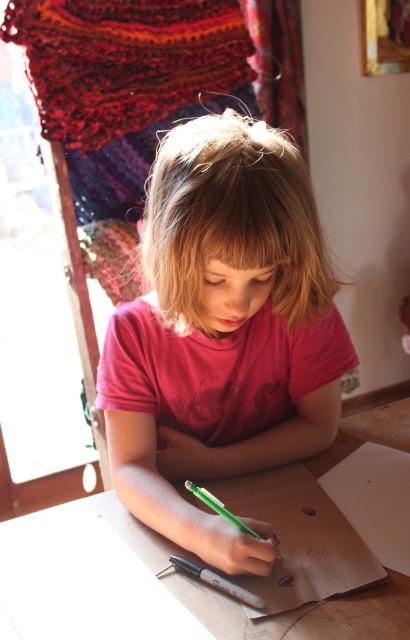
Question: Among these objects, which one is nearest to the camera?

Choices:
 (A) green plastic pencil at lower center
 (B) pink matte shirt at center
 (C) brown cardboard table at center
 (D) green matte pen at lower center

Answer: (C)

Question: Observing the image, what is the correct spatial positioning of brown cardboard table at center in reference to green plastic pencil at lower center?

Choices:
 (A) above
 (B) below

Answer: (B)

Question: Which of the following is the closest to the observer?

Choices:
 (A) pink matte shirt at center
 (B) green plastic pencil at lower center
 (C) green matte pen at lower center

Answer: (A)

Question: Can you confirm if brown cardboard table at center is thinner than green plastic pencil at lower center?

Choices:
 (A) yes
 (B) no

Answer: (B)

Question: Which of these objects is positioned farthest from the brown cardboard table at center?

Choices:
 (A) green matte pen at lower center
 (B) green plastic pencil at lower center
 (C) pink matte shirt at center

Answer: (C)

Question: Can you confirm if pink matte shirt at center is thinner than green matte pen at lower center?

Choices:
 (A) yes
 (B) no

Answer: (B)